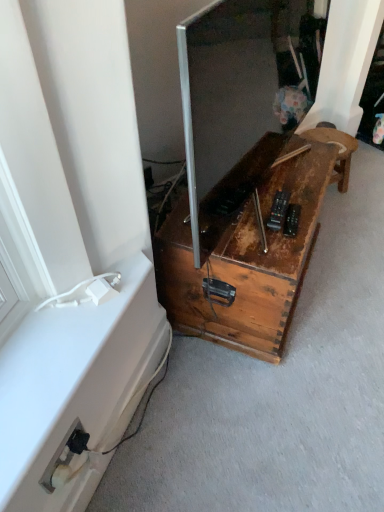
Question: Are white plastic electrical outlet at lower left and rusty wood stool at center, which is counted as the first furniture, starting from the right, far apart?

Choices:
 (A) yes
 (B) no

Answer: (A)

Question: From a real-world perspective, is white plastic electrical outlet at lower left beneath rusty wood stool at center, placed as the second furniture when sorted from left to right?

Choices:
 (A) no
 (B) yes

Answer: (A)

Question: Can rusty wood stool at center, placed as the second furniture when sorted from left to right, be found inside white plastic electrical outlet at lower left?

Choices:
 (A) yes
 (B) no

Answer: (B)

Question: Is white plastic electrical outlet at lower left beside rusty wood stool at center, which is counted as the first furniture, starting from the right?

Choices:
 (A) no
 (B) yes

Answer: (A)

Question: Considering the relative sizes of white plastic electrical outlet at lower left and rusty wood stool at center, placed as the second furniture when sorted from left to right, in the image provided, is white plastic electrical outlet at lower left thinner than rusty wood stool at center, placed as the second furniture when sorted from left to right,?

Choices:
 (A) no
 (B) yes

Answer: (B)

Question: Is white plastic electrical outlet at lower left facing towards rusty wood stool at center, which is counted as the first furniture, starting from the right?

Choices:
 (A) yes
 (B) no

Answer: (B)

Question: From the image's perspective, is rusty wood trunk at lower right, marked as the 2th furniture in a right-to-left arrangement, over white plastic electrical outlet at lower left?

Choices:
 (A) no
 (B) yes

Answer: (B)

Question: Can you confirm if rusty wood trunk at lower right, the 1th furniture in the left-to-right sequence, is bigger than white plastic electrical outlet at lower left?

Choices:
 (A) yes
 (B) no

Answer: (A)

Question: Can you confirm if rusty wood trunk at lower right, marked as the 2th furniture in a right-to-left arrangement, is positioned to the left of white plastic electrical outlet at lower left?

Choices:
 (A) yes
 (B) no

Answer: (B)

Question: Is white plastic electrical outlet at lower left surrounded by rusty wood trunk at lower right, marked as the 2th furniture in a right-to-left arrangement?

Choices:
 (A) no
 (B) yes

Answer: (A)

Question: Is rusty wood trunk at lower right, the 1th furniture in the left-to-right sequence, positioned far away from white plastic electrical outlet at lower left?

Choices:
 (A) yes
 (B) no

Answer: (B)

Question: Is rusty wood trunk at lower right, the 1th furniture in the left-to-right sequence, smaller than white plastic electrical outlet at lower left?

Choices:
 (A) yes
 (B) no

Answer: (B)

Question: Is rusty wood trunk at lower right, the 1th furniture in the left-to-right sequence, wider than metallic silver screen at center?

Choices:
 (A) no
 (B) yes

Answer: (B)